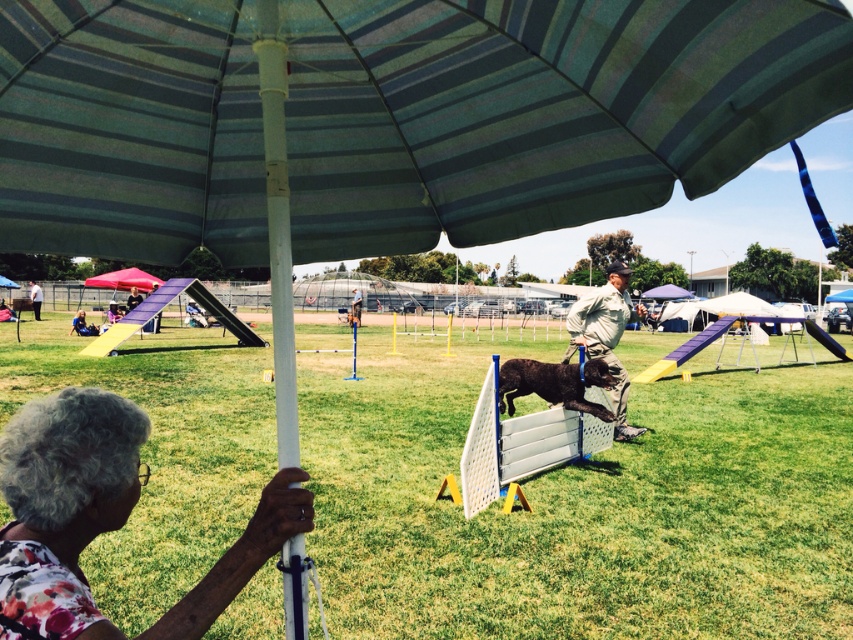
You are a photographer at the dog agility event and want to capture a photo of the green striped umbrella at upper center and the red fabric canopy at upper left. From your current position, which of these two objects is located to the right of the other?

The green striped umbrella at upper center is positioned on the right side of the red fabric canopy at upper left.